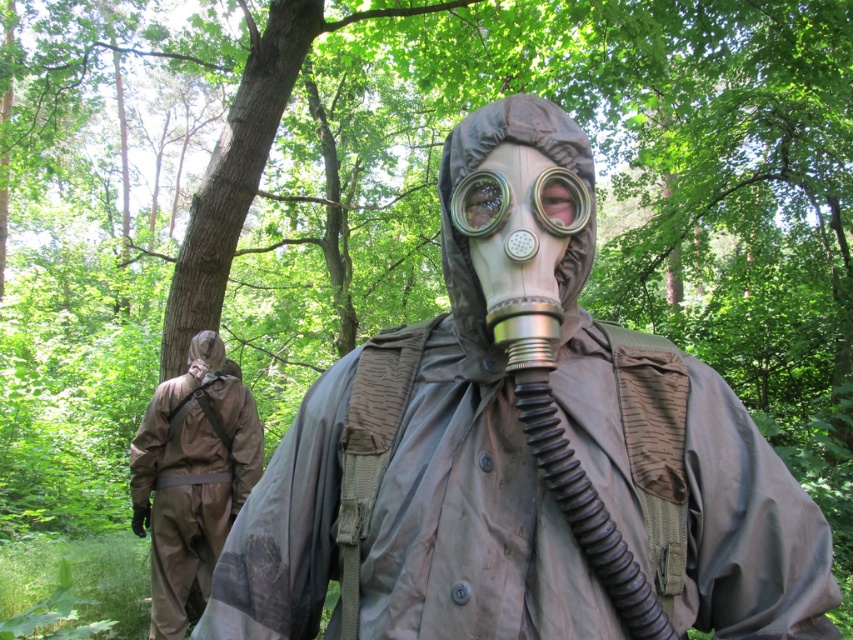
Question: Is matte khaki gas mask at center positioned before clear plastic goggles at center?

Choices:
 (A) yes
 (B) no

Answer: (A)

Question: From the image, what is the correct spatial relationship of tan fabric hazmat suit at rear in relation to clear plastic goggles at center?

Choices:
 (A) below
 (B) above

Answer: (A)

Question: Considering the real-world distances, which object is closest to the tan fabric hazmat suit at rear?

Choices:
 (A) clear plastic goggles at center
 (B) matte khaki gas mask at center

Answer: (B)

Question: Which point is farther from the camera taking this photo?

Choices:
 (A) (473, 211)
 (B) (241, 483)
 (C) (618, 452)

Answer: (B)

Question: Is matte khaki gas mask at center further to the viewer compared to clear plastic goggles at center?

Choices:
 (A) no
 (B) yes

Answer: (A)

Question: Which of these objects is positioned farthest from the clear plastic goggles at center?

Choices:
 (A) matte khaki gas mask at center
 (B) tan fabric hazmat suit at rear

Answer: (B)